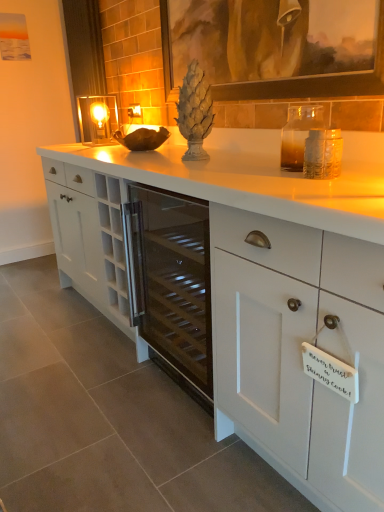
Question: Is matte brown picture frame at upper center positioned far away from matte glass candle holder at upper left?

Choices:
 (A) yes
 (B) no

Answer: (A)

Question: Does matte brown picture frame at upper center have a smaller size compared to matte glass candle holder at upper left?

Choices:
 (A) yes
 (B) no

Answer: (B)

Question: From a real-world perspective, is matte brown picture frame at upper center below matte glass candle holder at upper left?

Choices:
 (A) no
 (B) yes

Answer: (A)

Question: Can you see matte brown picture frame at upper center touching matte glass candle holder at upper left?

Choices:
 (A) no
 (B) yes

Answer: (A)

Question: Is the depth of matte brown picture frame at upper center greater than that of matte glass candle holder at upper left?

Choices:
 (A) no
 (B) yes

Answer: (A)

Question: Considering the relative sizes of matte brown picture frame at upper center and matte glass candle holder at upper left in the image provided, is matte brown picture frame at upper center wider than matte glass candle holder at upper left?

Choices:
 (A) no
 (B) yes

Answer: (A)

Question: Is matte brown picture frame at upper center behind matte glass electric outlet at center?

Choices:
 (A) yes
 (B) no

Answer: (B)

Question: Is matte brown picture frame at upper center directly adjacent to matte glass electric outlet at center?

Choices:
 (A) yes
 (B) no

Answer: (B)

Question: From the image's perspective, is matte brown picture frame at upper center located beneath matte glass electric outlet at center?

Choices:
 (A) yes
 (B) no

Answer: (A)

Question: From the image's perspective, is matte brown picture frame at upper center on top of matte glass electric outlet at center?

Choices:
 (A) no
 (B) yes

Answer: (A)

Question: Is matte brown picture frame at upper center thinner than matte glass electric outlet at center?

Choices:
 (A) yes
 (B) no

Answer: (B)

Question: From a real-world perspective, does matte brown picture frame at upper center sit lower than matte glass electric outlet at center?

Choices:
 (A) no
 (B) yes

Answer: (A)

Question: Could you tell me if white matte cabinet at center is turned towards matte brown picture frame at upper center?

Choices:
 (A) no
 (B) yes

Answer: (A)